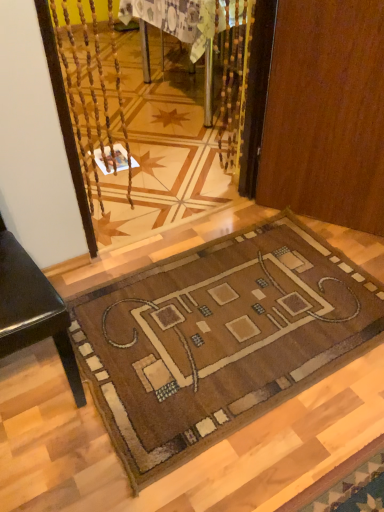
Question: From the image's perspective, relative to brown woven mat at lower center, is brown wood door at center above or below?

Choices:
 (A) below
 (B) above

Answer: (B)

Question: Relative to brown woven mat at lower center, is brown wood door at center in front or behind?

Choices:
 (A) front
 (B) behind

Answer: (B)

Question: Which object is positioned farthest from the wooden table at center?

Choices:
 (A) brown woven mat at lower center
 (B) brown wood door at center

Answer: (A)

Question: Which of these objects is positioned closest to the brown wood door at center?

Choices:
 (A) brown woven mat at lower center
 (B) wooden table at center

Answer: (A)